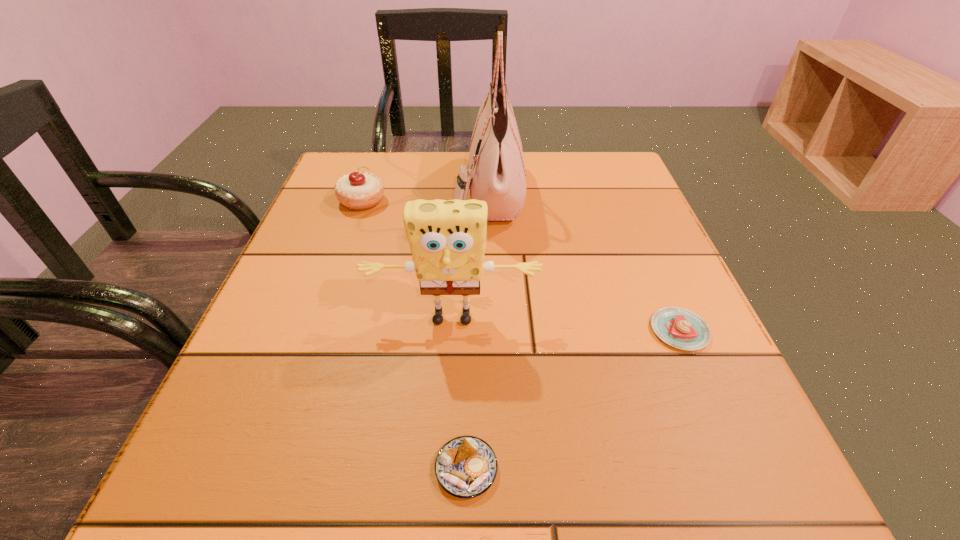
This screenshot has height=540, width=960. Find the location of `free spot that satisfies the following two spatial constraints: 1. on the face of the rightmost pastry; 2. on the right side of the sponge`. free spot that satisfies the following two spatial constraints: 1. on the face of the rightmost pastry; 2. on the right side of the sponge is located at coordinates (451, 330).

Locate an element on the screen. The image size is (960, 540). vacant space that satisfies the following two spatial constraints: 1. on the front side of the second nearest pastry; 2. on the right side of the leftmost object is located at coordinates coord(317,330).

You are a GUI agent. You are given a task and a screenshot of the screen. Output one action in this format:
    pyautogui.click(x=<x>, y=<y>)
    Task: Click on the free space that satisfies the following two spatial constraints: 1. on the face of the rightmost object; 2. on the right side of the sponge
    The width and height of the screenshot is (960, 540).
    Given the screenshot: What is the action you would take?
    pyautogui.click(x=451, y=330)

You are a GUI agent. You are given a task and a screenshot of the screen. Output one action in this format:
    pyautogui.click(x=<x>, y=<y>)
    Task: Click on the vacant area in the image that satisfies the following two spatial constraints: 1. on the back side of the nearest pastry; 2. on the left side of the rightmost pastry
    
    Given the screenshot: What is the action you would take?
    [x=469, y=330]